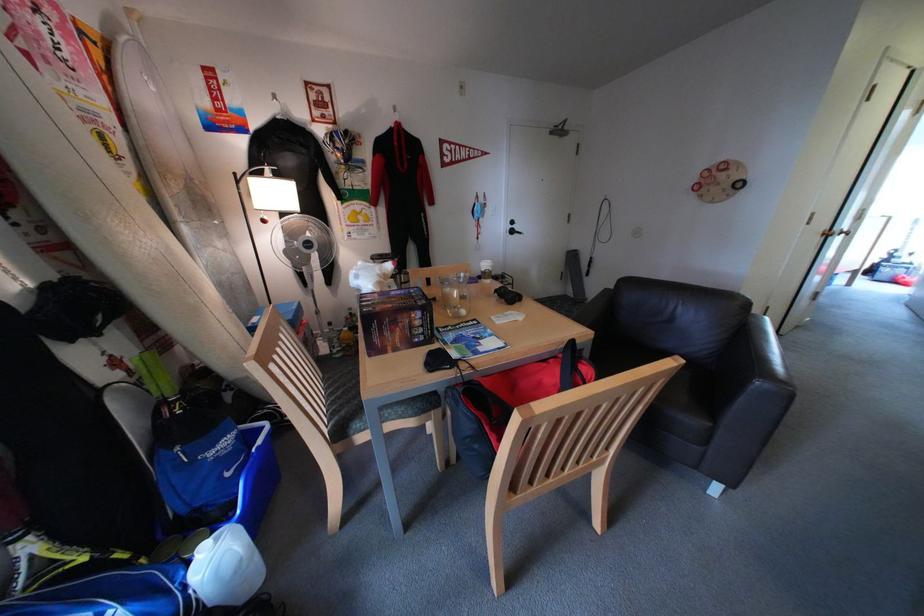
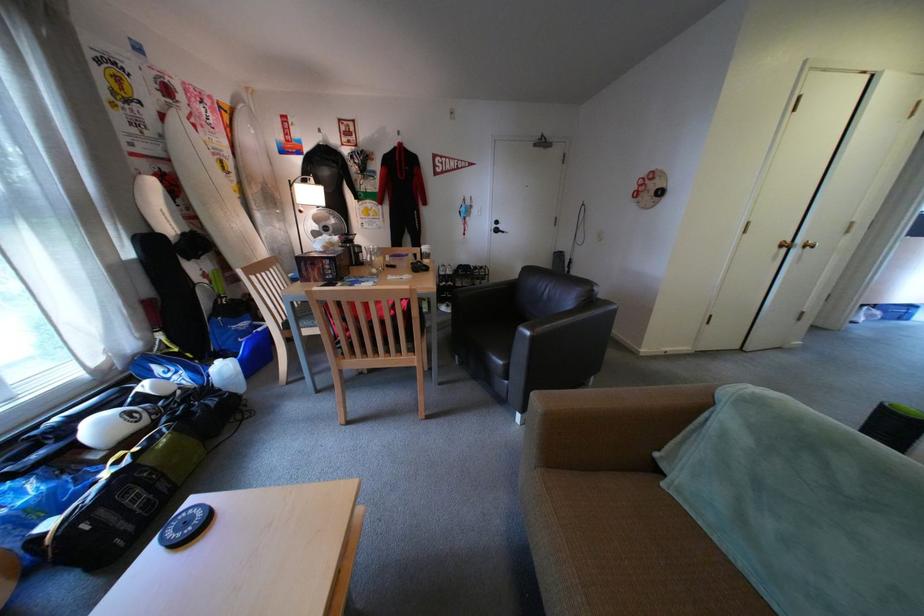
In the second image, find the point that corresponds to (x=405, y=357) in the first image.

(325, 285)